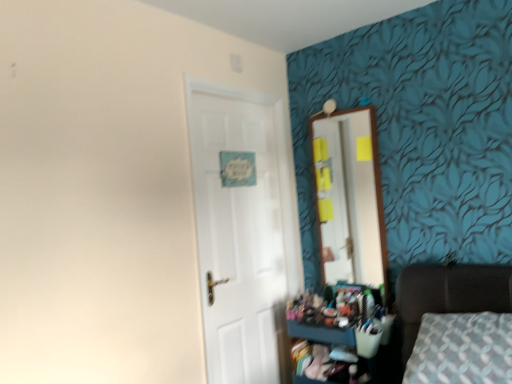
This screenshot has height=384, width=512. I want to click on wooden mirror at upper right, so click(x=350, y=198).

This screenshot has width=512, height=384. Describe the element at coordinates (350, 198) in the screenshot. I see `wooden mirror at upper right` at that location.

Where is `dark brown leather bed at lower right`? Image resolution: width=512 pixels, height=384 pixels. dark brown leather bed at lower right is located at coordinates (448, 293).

Does white glossy door at center have a lesser height compared to dark brown leather bed at lower right?

In fact, white glossy door at center may be taller than dark brown leather bed at lower right.

Is there a large distance between white glossy door at center and dark brown leather bed at lower right?

No, white glossy door at center is not far away from dark brown leather bed at lower right.

Considering the sizes of objects white glossy door at center and dark brown leather bed at lower right in the image provided, who is wider, white glossy door at center or dark brown leather bed at lower right?

dark brown leather bed at lower right.

From the image's perspective, which is below, white glossy door at center or dark brown leather bed at lower right?

dark brown leather bed at lower right appears lower in the image.

Looking at their sizes, would you say dark brown leather bed at lower right is wider or thinner than wooden mirror at upper right?

In the image, dark brown leather bed at lower right appears to be wider than wooden mirror at upper right.

Is dark brown leather bed at lower right turned away from wooden mirror at upper right?

No, dark brown leather bed at lower right is not facing the opposite direction of wooden mirror at upper right.

From a real-world perspective, is dark brown leather bed at lower right over wooden mirror at upper right?

Incorrect, from a real-world perspective, dark brown leather bed at lower right is lower than wooden mirror at upper right.

From the image's perspective, is dark brown leather bed at lower right located beneath wooden mirror at upper right?

Yes.

Would you say wooden dresser at lower right is part of wooden mirror at upper right's contents?

No.

Would you consider wooden mirror at upper right to be distant from wooden dresser at lower right?

No, there isn't a large distance between wooden mirror at upper right and wooden dresser at lower right.

Considering the positions of point (380, 250) and point (358, 293), is point (380, 250) closer or farther from the camera than point (358, 293)?

Point (380, 250).

Is wooden dresser at lower right turned away from white glossy door at center?

No, white glossy door at center is not at the back of wooden dresser at lower right.

Which is more to the right, wooden dresser at lower right or white glossy door at center?

wooden dresser at lower right.

Does wooden dresser at lower right have a greater height compared to white glossy door at center?

No, wooden dresser at lower right is not taller than white glossy door at center.

At what (x,y) coordinates should I click in order to perform the action: click on dresser on the left of the dark brown leather bed at lower right. Please return your answer as a coordinate pair (x, y). This screenshot has height=384, width=512. Looking at the image, I should click on (339, 337).

Is dark brown leather bed at lower right wider or thinner than wooden dresser at lower right?

dark brown leather bed at lower right is wider than wooden dresser at lower right.

Considering the positions of objects dark brown leather bed at lower right and wooden dresser at lower right in the image provided, who is more to the right, dark brown leather bed at lower right or wooden dresser at lower right?

dark brown leather bed at lower right.

Is dark brown leather bed at lower right situated inside wooden dresser at lower right or outside?

dark brown leather bed at lower right is not inside wooden dresser at lower right, it's outside.

The height and width of the screenshot is (384, 512). In the image, there is a wooden mirror at upper right. Find the location of `door below it (from the image's perspective)`. door below it (from the image's perspective) is located at coordinates (242, 232).

From a real-world perspective, is white glossy door at center above or below wooden mirror at upper right?

Clearly, from a real-world perspective, white glossy door at center is below wooden mirror at upper right.

Is white glossy door at center turned away from wooden mirror at upper right?

That's not correct — white glossy door at center is not looking away from wooden mirror at upper right.

Is dark brown leather bed at lower right positioned behind white glossy door at center?

No, dark brown leather bed at lower right is in front of white glossy door at center.

Can you confirm if dark brown leather bed at lower right is taller than white glossy door at center?

In fact, dark brown leather bed at lower right may be shorter than white glossy door at center.

From the image's perspective, who appears lower, dark brown leather bed at lower right or white glossy door at center?

dark brown leather bed at lower right appears lower in the image.

The image size is (512, 384). I want to click on furniture in front of the white glossy door at center, so click(x=448, y=293).

Identify the location of mirror behind the dark brown leather bed at lower right. (350, 198).

Estimate the real-world distances between objects in this image. Which object is further from wooden dresser at lower right, wooden mirror at upper right or dark brown leather bed at lower right?

wooden mirror at upper right lies further to wooden dresser at lower right than the other object.

Based on their spatial positions, is wooden dresser at lower right or wooden mirror at upper right further from white glossy door at center?

Among the two, wooden mirror at upper right is located further to white glossy door at center.

Looking at the image, which one is located further to dark brown leather bed at lower right, wooden mirror at upper right or white glossy door at center?

Based on the image, white glossy door at center appears to be further to dark brown leather bed at lower right.

Based on their spatial positions, is wooden mirror at upper right or wooden dresser at lower right closer to white glossy door at center?

wooden dresser at lower right is positioned closer to the anchor white glossy door at center.

From the image, which object appears to be nearer to wooden dresser at lower right, white glossy door at center or dark brown leather bed at lower right?

The object closer to wooden dresser at lower right is dark brown leather bed at lower right.

From the image, which object appears to be farther from wooden dresser at lower right, dark brown leather bed at lower right or white glossy door at center?

white glossy door at center is positioned further to the anchor wooden dresser at lower right.

Looking at this image, estimate the real-world distances between objects in this image. Which object is further from wooden mirror at upper right, white glossy door at center or wooden dresser at lower right?

Based on the image, wooden dresser at lower right appears to be further to wooden mirror at upper right.

Considering their positions, is dark brown leather bed at lower right positioned closer to white glossy door at center than wooden dresser at lower right?

The object closer to white glossy door at center is wooden dresser at lower right.

Image resolution: width=512 pixels, height=384 pixels. What are the coordinates of `door that lies between wooden mirror at upper right and wooden dresser at lower right from top to bottom` in the screenshot? It's located at (242, 232).

Identify the location of dresser between dark brown leather bed at lower right and wooden mirror at upper right in the front-back direction. (339, 337).

Locate an element on the screen. The image size is (512, 384). door positioned between dark brown leather bed at lower right and wooden mirror at upper right from near to far is located at coordinates (242, 232).

Find the location of `dresser between dark brown leather bed at lower right and white glossy door at center along the z-axis`. dresser between dark brown leather bed at lower right and white glossy door at center along the z-axis is located at coordinates (339, 337).